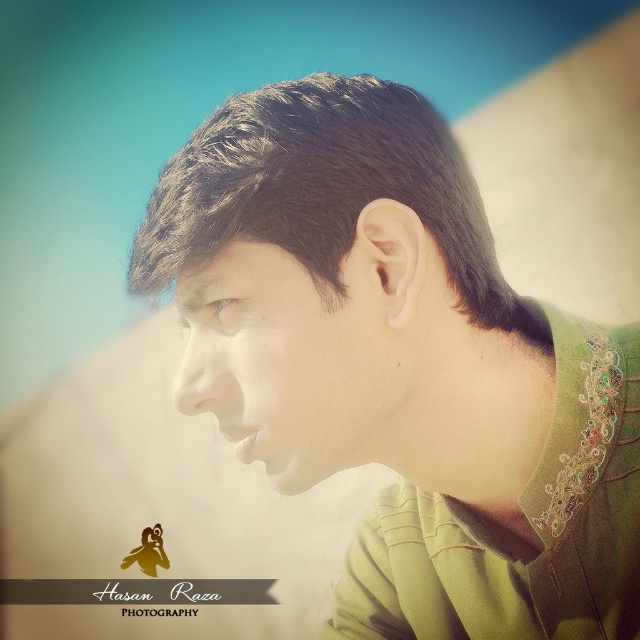
You are a photographer adjusting your camera settings to focus on the subject. Since the green embroidered shirt at center and the dark brown hair at center are both in the frame, which one is closer to you?

The green embroidered shirt at center is closer to you than the dark brown hair at center because it is further to the viewer.

You are a photographer adjusting the lighting for a portrait. You notice the dark brown hair at center and the smooth skin face at center. Which object is closer to the camera lens?

The dark brown hair at center is closer to the camera lens because it is positioned in front of the smooth skin face at center.

Looking at this image, you are an artist trying to sketch this person. You notice two points on their shirt, one at coordinate point (177, 204) and another at point (232, 300). Which point should you shade darker to create a 3D effect if you want to emphasize depth based on their position relative to the viewer?

Point (177, 204) should be shaded darker because it is closer to the viewer than point (232, 300), creating a 3D effect by emphasizing depth.